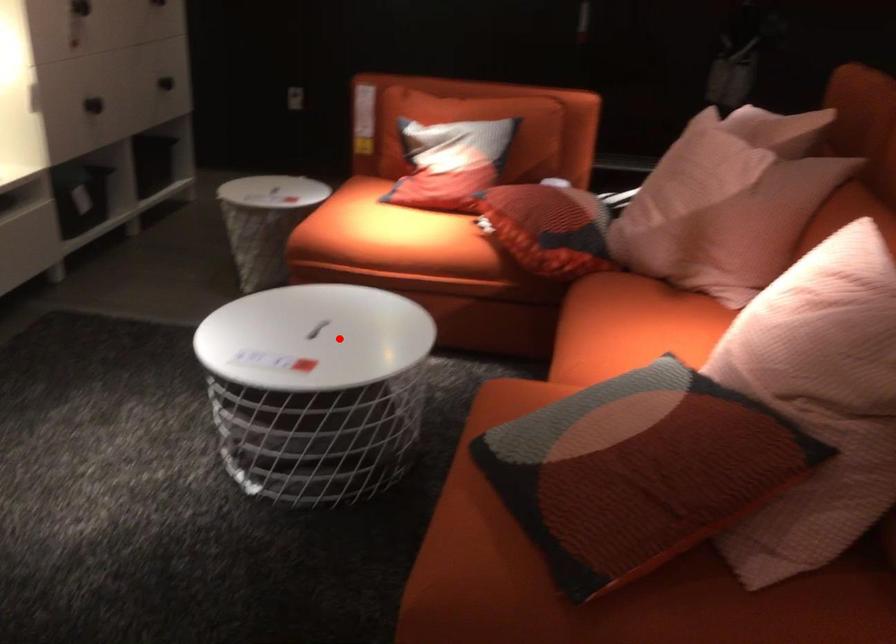
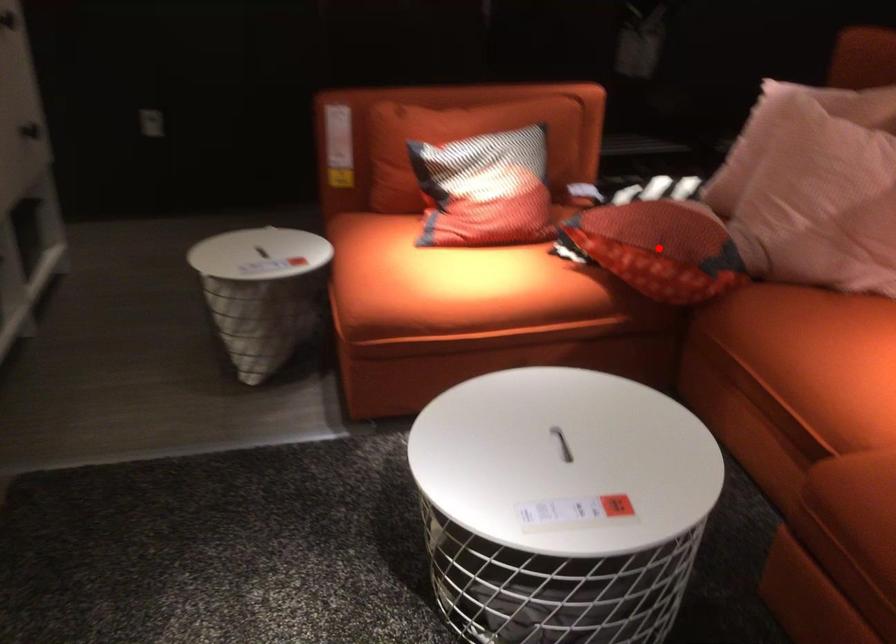
I am providing you with two images of the same scene from different viewpoints. A red point is marked on the first image and another point is marked on the second image. Does the point marked in image1 correspond to the same location as the one in image2?

No